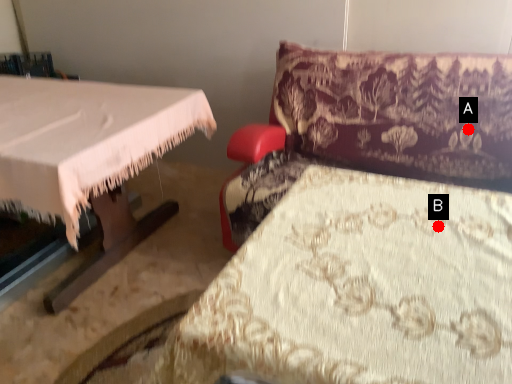
Question: Two points are circled on the image, labeled by A and B beside each circle. Which point appears farthest from the camera in this image?

Choices:
 (A) A is further
 (B) B is further

Answer: (A)